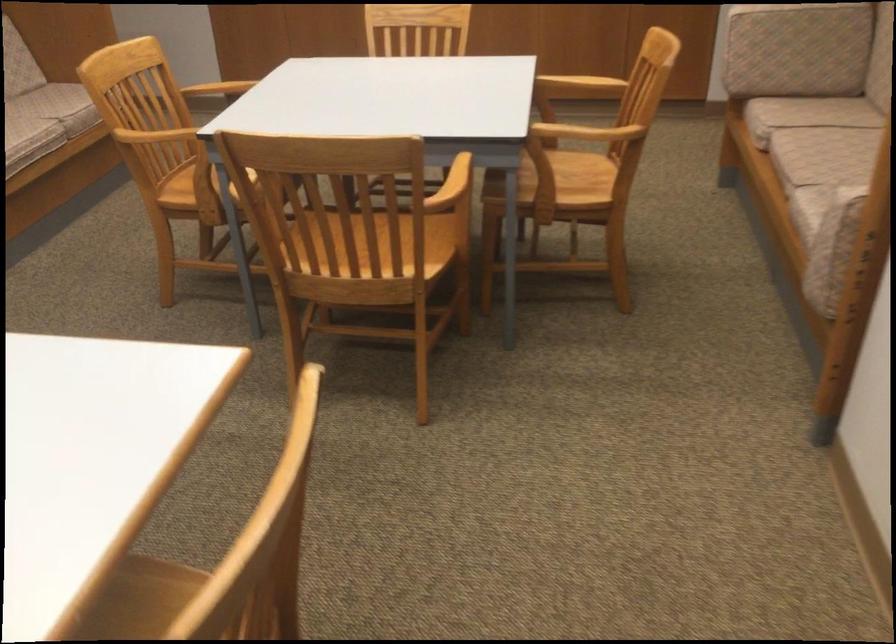
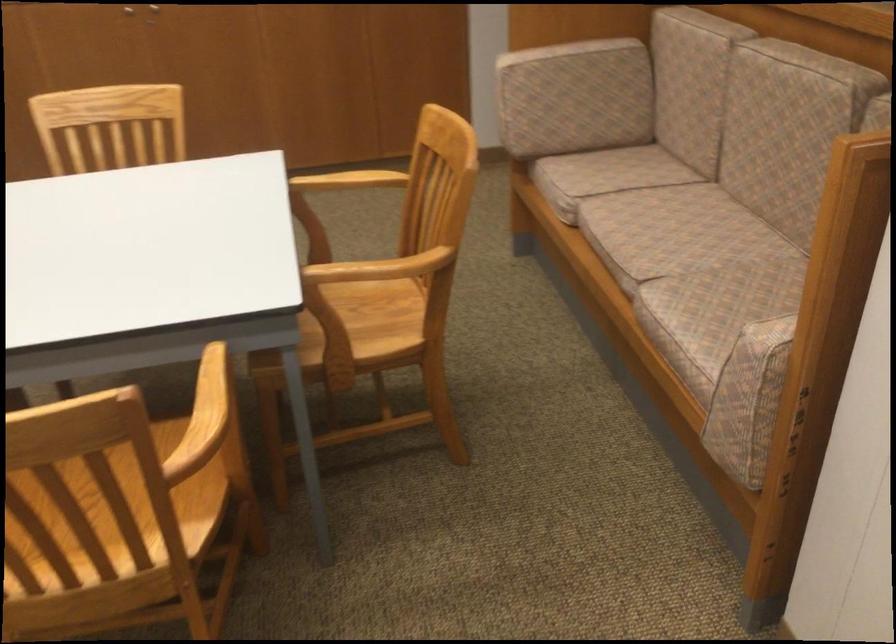
Question: What movement of the cameraman would produce the second image?

Choices:
 (A) Left
 (B) Right
 (C) Forward
 (D) Backward

Answer: (C)